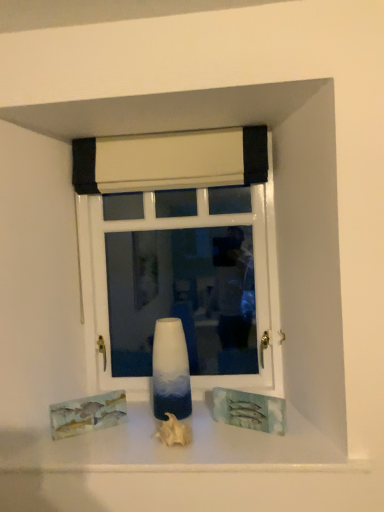
Question: Does white glossy window at center appear on the right side of white fabric curtain at upper center?

Choices:
 (A) yes
 (B) no

Answer: (A)

Question: Are white glossy window at center and white fabric curtain at upper center far apart?

Choices:
 (A) yes
 (B) no

Answer: (B)

Question: From the image's perspective, is white glossy window at center below white fabric curtain at upper center?

Choices:
 (A) yes
 (B) no

Answer: (A)

Question: Does white glossy window at center lie behind white fabric curtain at upper center?

Choices:
 (A) no
 (B) yes

Answer: (B)

Question: From the image's perspective, is white glossy window at center over white fabric curtain at upper center?

Choices:
 (A) yes
 (B) no

Answer: (B)

Question: Relative to white matte seashell at center, the first art viewed from the right, is white glossy vase at center in front or behind?

Choices:
 (A) behind
 (B) front

Answer: (A)

Question: Is white glossy vase at center bigger or smaller than white matte seashell at center, placed as the second art when sorted from left to right?

Choices:
 (A) small
 (B) big

Answer: (B)

Question: Considering the positions of point (167, 392) and point (187, 441), is point (167, 392) closer or farther from the camera than point (187, 441)?

Choices:
 (A) closer
 (B) farther

Answer: (B)

Question: From the image's perspective, is white glossy vase at center located above or below white matte seashell at center, the first art viewed from the right?

Choices:
 (A) above
 (B) below

Answer: (A)

Question: In terms of size, does watercolor paper painting at lower left, arranged as the first art when viewed from the left, appear bigger or smaller than white glossy window at center?

Choices:
 (A) small
 (B) big

Answer: (A)

Question: Considering the positions of point (79, 400) and point (273, 301), is point (79, 400) closer or farther from the camera than point (273, 301)?

Choices:
 (A) closer
 (B) farther

Answer: (A)

Question: Do you think watercolor paper painting at lower left, arranged as the first art when viewed from the left, is within white glossy window at center, or outside of it?

Choices:
 (A) outside
 (B) inside

Answer: (A)

Question: In terms of height, does watercolor paper painting at lower left, marked as the 2th art in a right-to-left arrangement, look taller or shorter compared to white glossy window at center?

Choices:
 (A) tall
 (B) short

Answer: (B)

Question: From a real-world perspective, is white matte seashell at center, the first art viewed from the right, above or below watercolor paper painting at lower left, marked as the 2th art in a right-to-left arrangement?

Choices:
 (A) above
 (B) below

Answer: (B)

Question: Is white matte seashell at center, the first art viewed from the right, to the left or to the right of watercolor paper painting at lower left, arranged as the first art when viewed from the left, in the image?

Choices:
 (A) left
 (B) right

Answer: (B)